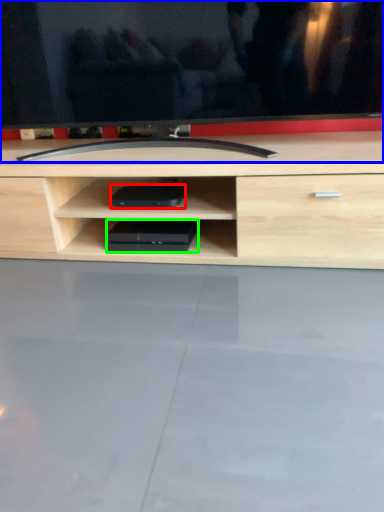
Question: Considering the real-world distances, which object is farthest from equipment (highlighted by a red box)? television (highlighted by a blue box) or equipment (highlighted by a green box)?

Choices:
 (A) television
 (B) equipment

Answer: (A)